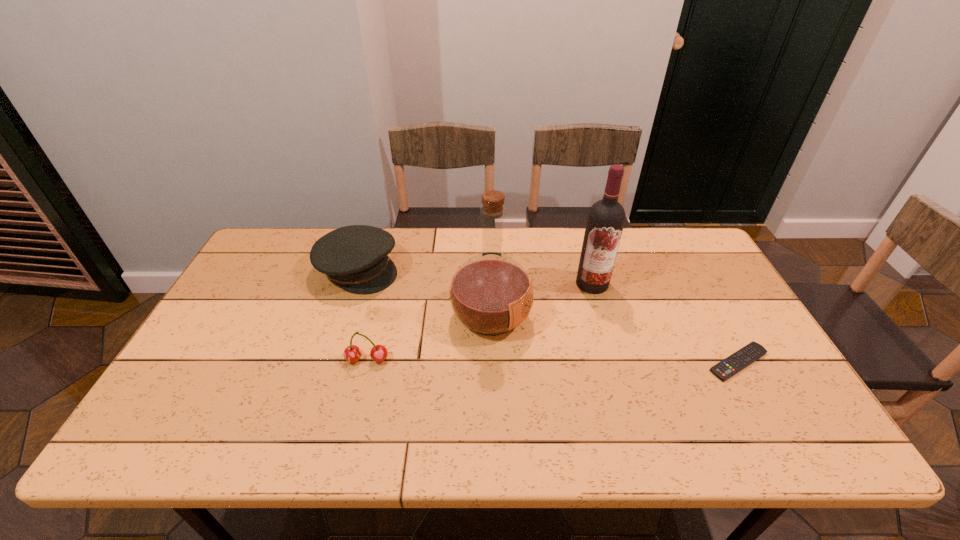
Find the location of `free space located 0.200m on the label of the wine bottle`. free space located 0.200m on the label of the wine bottle is located at coordinates (572, 341).

Find the location of a particular element. vacant space positioned 0.390m on the front-facing side of the beret is located at coordinates (489, 345).

Locate an element on the screen. The width and height of the screenshot is (960, 540). free space located on the front-facing side of the beret is located at coordinates (483, 342).

At what (x,y) coordinates should I click in order to perform the action: click on vacant area situated on the front-facing side of the beret. Please return your answer as a coordinate pair (x, y). This screenshot has width=960, height=540. Looking at the image, I should click on (492, 347).

You are a GUI agent. You are given a task and a screenshot of the screen. Output one action in this format:
    pyautogui.click(x=<x>, y=<y>)
    Task: Click on the vacant space located 0.240m on the front label of the third object from left to right
    
    Given the screenshot: What is the action you would take?
    pyautogui.click(x=612, y=367)

Identify the location of free space located 0.340m on the front label of the third object from left to right. The height and width of the screenshot is (540, 960). (653, 384).

You are a GUI agent. You are given a task and a screenshot of the screen. Output one action in this format:
    pyautogui.click(x=<x>, y=<y>)
    Task: Click on the vacant space located 0.190m on the front label of the third object from left to right
    This screenshot has height=540, width=960.
    Given the screenshot: What is the action you would take?
    (x=593, y=360)

Locate an element on the screen. object that is at the far edge is located at coordinates (355, 257).

Where is `object that is positioned at the near edge`? This screenshot has height=540, width=960. object that is positioned at the near edge is located at coordinates (725, 369).

Where is `object that is at the right edge`? object that is at the right edge is located at coordinates (725, 369).